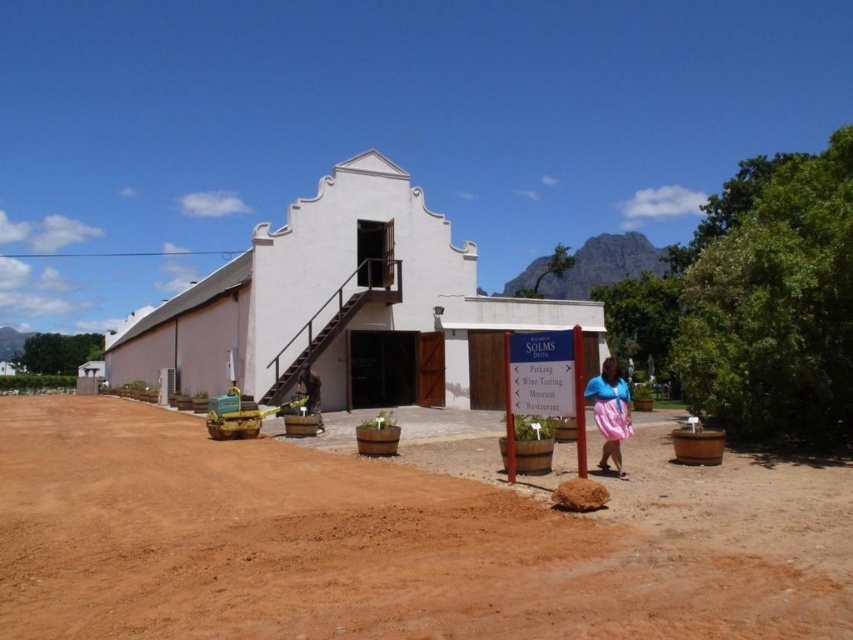
Is white matte building at center positioned before pink satin skirt at lower right?

No, it is not.

Based on the photo, can you confirm if white matte building at center is positioned above pink satin skirt at lower right?

Indeed, white matte building at center is positioned over pink satin skirt at lower right.

Who is more distant from viewer, (268, 280) or (610, 378)?

Point (268, 280)

Where is `white matte building at center`? The height and width of the screenshot is (640, 853). white matte building at center is located at coordinates (345, 307).

Is brown dirt field at center bigger than pink satin skirt at lower right?

Correct, brown dirt field at center is larger in size than pink satin skirt at lower right.

Is the position of brown dirt field at center less distant than that of pink satin skirt at lower right?

That is True.

Is point (345, 515) less distant than point (614, 456)?

Yes, point (345, 515) is in front of point (614, 456).

You are a GUI agent. You are given a task and a screenshot of the screen. Output one action in this format:
    pyautogui.click(x=<x>, y=<y>)
    Task: Click on the brown dirt field at center
    This screenshot has width=853, height=640.
    Given the screenshot: What is the action you would take?
    pyautogui.click(x=335, y=547)

Looking at this image, between white matte building at center and yellow fabric bag at center, which one is positioned higher?

white matte building at center is above.

Find the location of `white matte building at center`. white matte building at center is located at coordinates (345, 307).